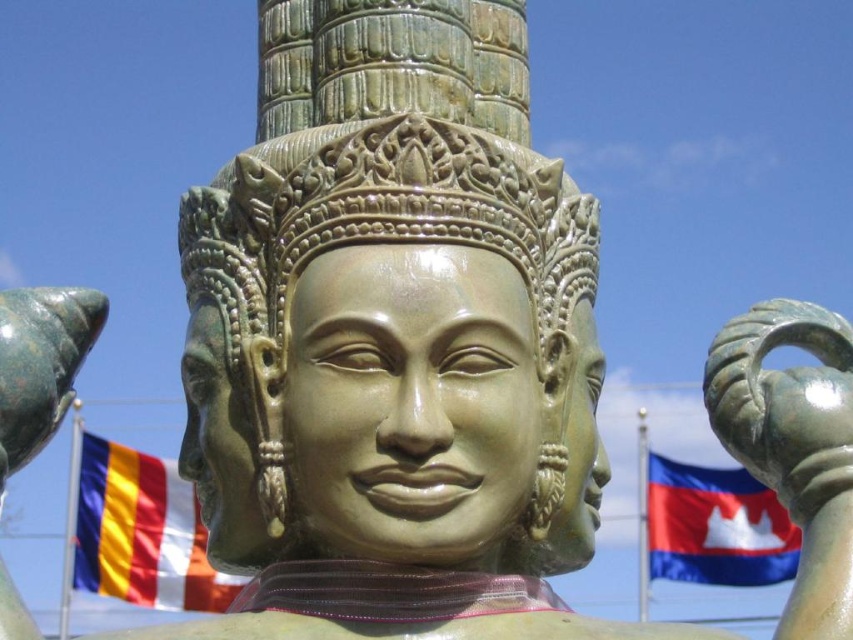
You are standing in front of the bronze statue and want to know how far the point at coordinates point (521, 156) is from you. Can you determine the distance?

The distance of point (521, 156) from camera is 152.17 feet.

You are standing in front of the bronze statue at center and want to place a small offering on the blue fabric flag at lower right. Can you place it directly in front of the statue without moving the flag?

The bronze statue at center is above the blue fabric flag at lower right, so you can place the offering directly in front of the statue on the flag since it is positioned below the statue.